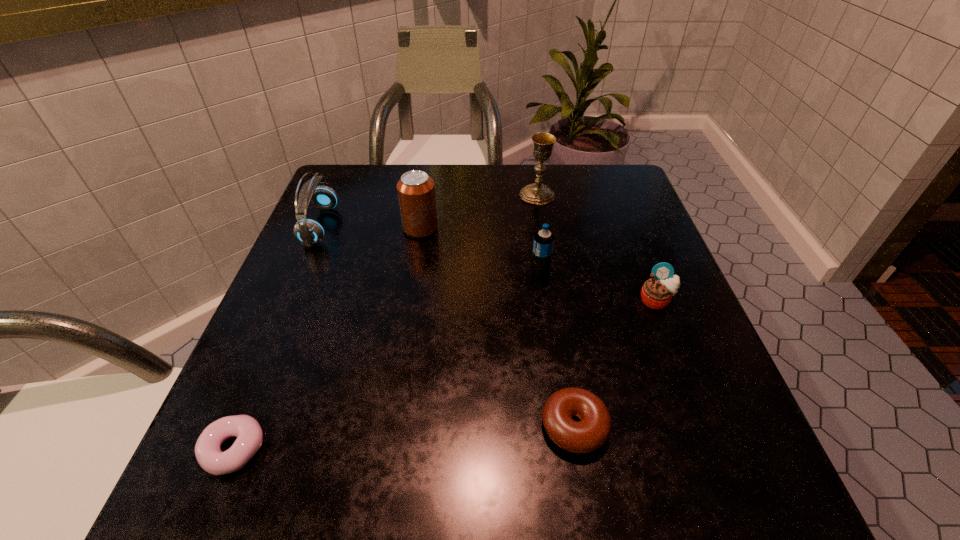
In order to click on vacant space that satisfies the following two spatial constraints: 1. on the ear cups of the headset; 2. on the back side of the soda bottle in this screenshot , I will do `click(300, 272)`.

This screenshot has width=960, height=540. Find the location of `free point that satisfies the following two spatial constraints: 1. on the ear cups of the can; 2. on the right side of the headset`. free point that satisfies the following two spatial constraints: 1. on the ear cups of the can; 2. on the right side of the headset is located at coordinates (320, 228).

Find the location of a particular element. The height and width of the screenshot is (540, 960). free location that satisfies the following two spatial constraints: 1. on the ear cups of the headset; 2. on the left side of the right doughnut is located at coordinates (235, 426).